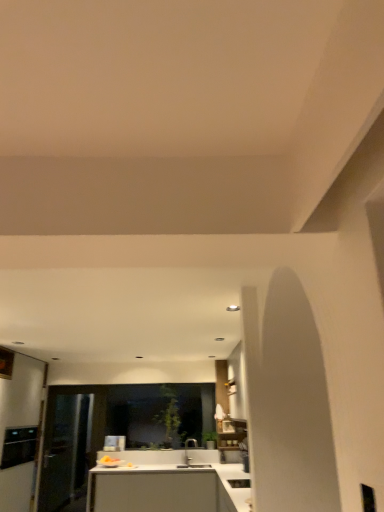
Question: Considering the positions of point (6, 462) and point (231, 480), is point (6, 462) closer or farther from the camera than point (231, 480)?

Choices:
 (A) farther
 (B) closer

Answer: (A)

Question: Is black stainless steel oven at left, the second appliance when ordered from front to back, in front of or behind white glossy sink at lower center, which is the second appliance in left-to-right order, in the image?

Choices:
 (A) front
 (B) behind

Answer: (B)

Question: Which object is the farthest from the matte silver faucet at center?

Choices:
 (A) white glossy countertop at center
 (B) transparent glass door at left
 (C) white glossy sink at lower center, which appears as the second appliance when viewed from the back
 (D) black stainless steel oven at left, placed as the second appliance when sorted from right to left

Answer: (D)

Question: Estimate the real-world distances between objects in this image. Which object is farther from the transparent glass door at left?

Choices:
 (A) matte silver faucet at center
 (B) white glossy sink at lower center, which appears as the second appliance when viewed from the back
 (C) white glossy countertop at center
 (D) black stainless steel oven at left, acting as the 1th appliance starting from the left

Answer: (B)